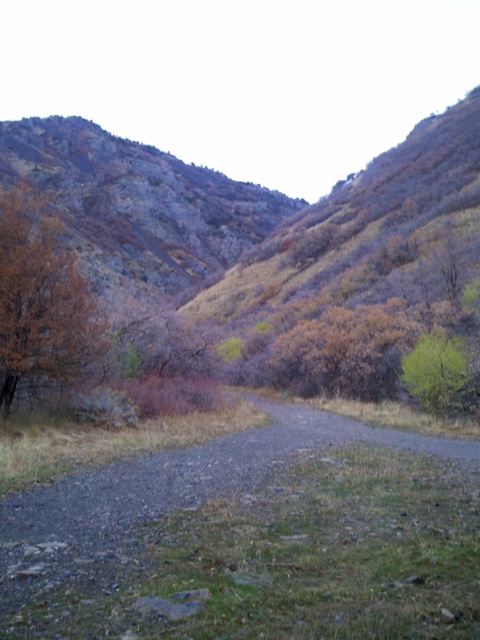
You are an outdoor photographer planning to capture the gray gravel path at center and the green leafy tree at center in a single frame. Based on their positions, which object will appear closer to the bottom of your camera viewfinder?

The gray gravel path at center will appear closer to the bottom of the camera viewfinder because it has a lesser height compared to the green leafy tree at center.